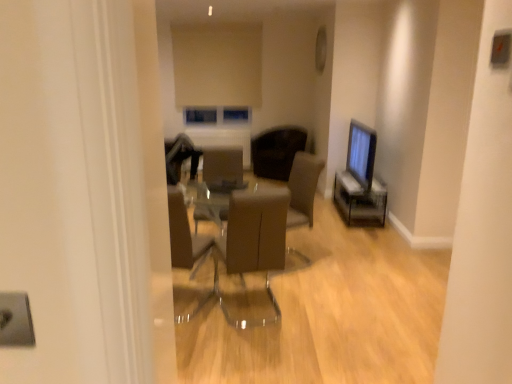
Image resolution: width=512 pixels, height=384 pixels. I want to click on unoccupied region to the right of brown leather chair at center, the second chair viewed from the back, so click(313, 309).